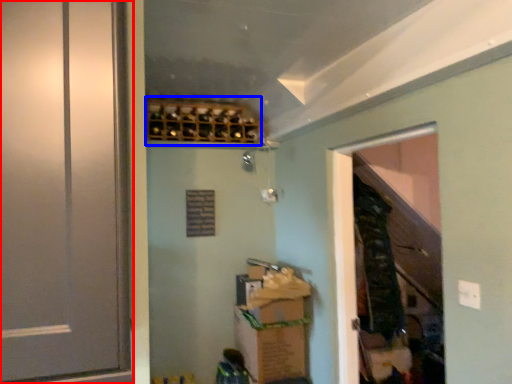
Question: Which object is further to the camera taking this photo, door (highlighted by a red box) or wine rack (highlighted by a blue box)?

Choices:
 (A) door
 (B) wine rack

Answer: (B)